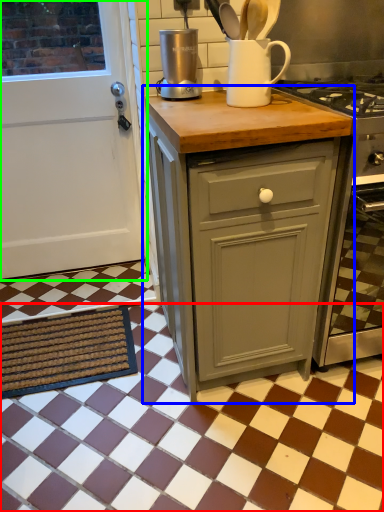
Question: Considering the real-world distances, which object is farthest from tile (highlighted by a red box)? cabinetry (highlighted by a blue box) or door (highlighted by a green box)?

Choices:
 (A) cabinetry
 (B) door

Answer: (B)